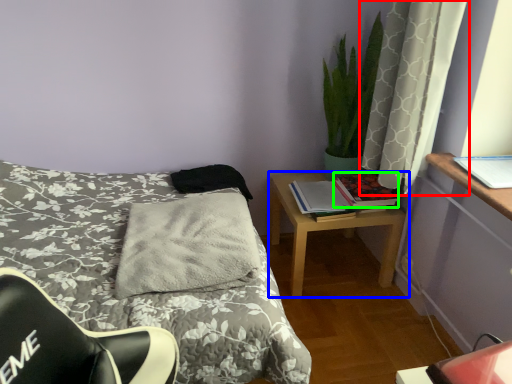
Question: Based on their relative distances, which object is farther from curtain (highlighted by a red box)? Choose from nightstand (highlighted by a blue box) and book (highlighted by a green box).

Choices:
 (A) nightstand
 (B) book

Answer: (A)